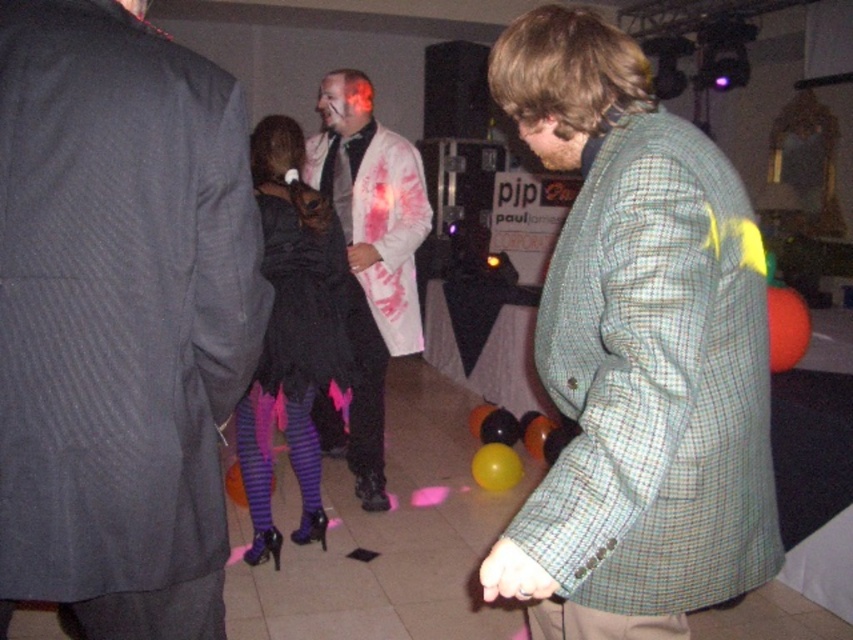
You are standing in the middle of the room and want to move towards the black satin dress at center. Which direction should you move in?

Since the black satin dress at center is located at point 0.525 on the x axis and 0.343 on the y axis, you should move towards the center of the room to reach it.

You are a photographer at the event and want to take a photo of the black satin dress at center and the black rubber balloon at center so that both are clearly visible. Based on their positions, which object should you focus on first to ensure the other remains in the background?

You should focus on the black satin dress at center first because it is in front of the black rubber balloon at center, ensuring the balloon stays in the background.